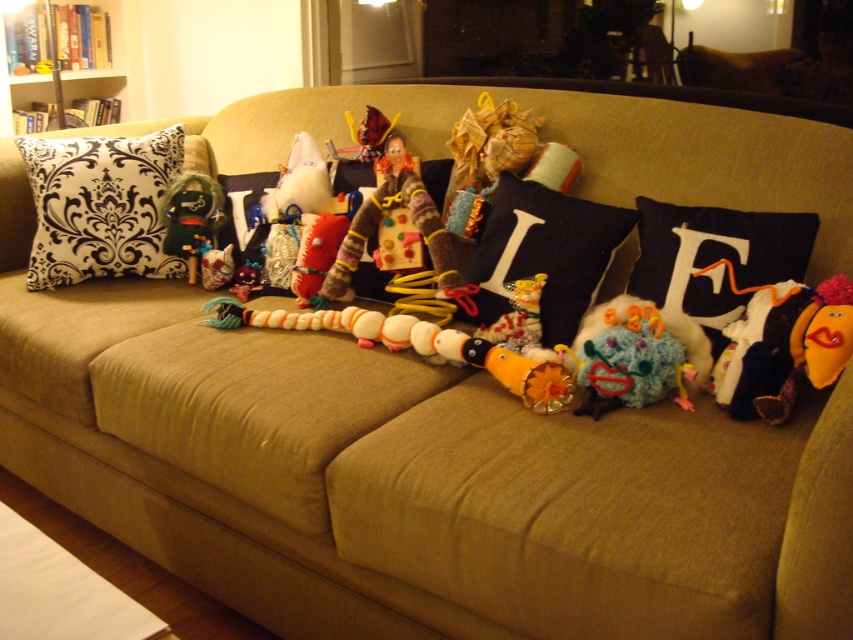
Between point (575, 352) and point (518, 369), which one is positioned behind?

The point (575, 352) is more distant.

Can you confirm if knitted multicolored toy at center is positioned below orange plush toy at center?

Actually, knitted multicolored toy at center is above orange plush toy at center.

What are the coordinates of `knitted multicolored toy at center` in the screenshot? It's located at (627, 358).

Does knitted multicolored toy at center have a greater height compared to black damask pillow at center?

No, knitted multicolored toy at center is not taller than black damask pillow at center.

In order to click on knitted multicolored toy at center in this screenshot , I will do `click(627, 358)`.

This screenshot has height=640, width=853. I want to click on knitted multicolored toy at center, so pos(627,358).

Does navy blue fabric pillow at center have a lesser width compared to orange plush toy at right?

In fact, navy blue fabric pillow at center might be wider than orange plush toy at right.

Who is higher up, navy blue fabric pillow at center or orange plush toy at right?

navy blue fabric pillow at center

Does point (579, 214) come behind point (848, 321)?

Yes.

The height and width of the screenshot is (640, 853). I want to click on navy blue fabric pillow at center, so click(543, 253).